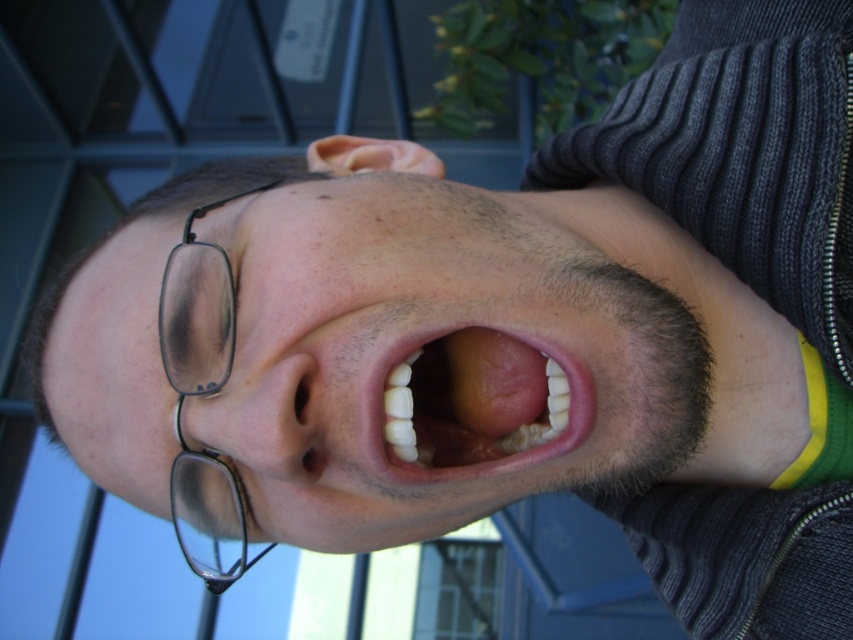
Question: Can you confirm if smooth skin face at center is bigger than black plastic glasses at left?

Choices:
 (A) yes
 (B) no

Answer: (A)

Question: Can you confirm if white glossy teeth at center is bigger than black plastic glasses at left?

Choices:
 (A) yes
 (B) no

Answer: (B)

Question: Does white glossy teeth at center come behind black plastic glasses at left?

Choices:
 (A) no
 (B) yes

Answer: (A)

Question: Among these points, which one is farthest from the camera?

Choices:
 (A) (489, 424)
 (B) (225, 368)
 (C) (543, 417)

Answer: (A)

Question: Which of the following is the farthest from the observer?

Choices:
 (A) black plastic glasses at left
 (B) smooth skin face at center
 (C) white glossy teeth at center

Answer: (A)

Question: Which is farther from the black plastic glasses at left?

Choices:
 (A) white glossy teeth at center
 (B) smooth skin face at center

Answer: (A)